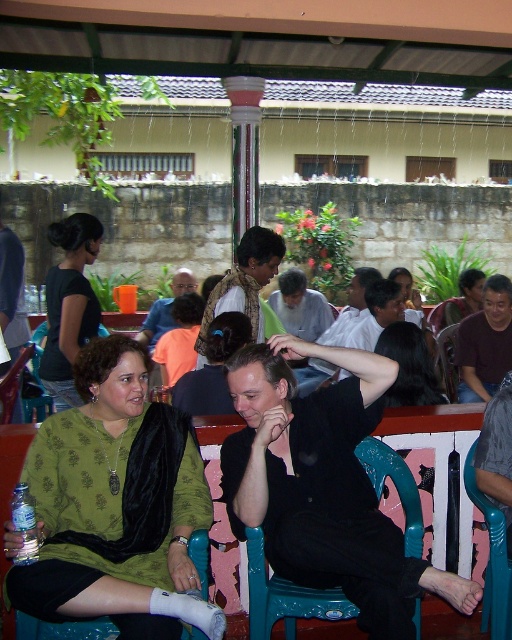
Consider the image. Based on the scene description, where is the green fabric shawl at center located in terms of its coordinates?

The green fabric shawl at center is located at coordinates point (117, 506).

You are at a social gathering and see two items in the scene. One is the matte black shirt at upper left and the other is the matte green scarf at center. Which item is located more to the left side?

The matte black shirt at upper left is positioned on the left side of the matte green scarf at center, so it is more to the left.